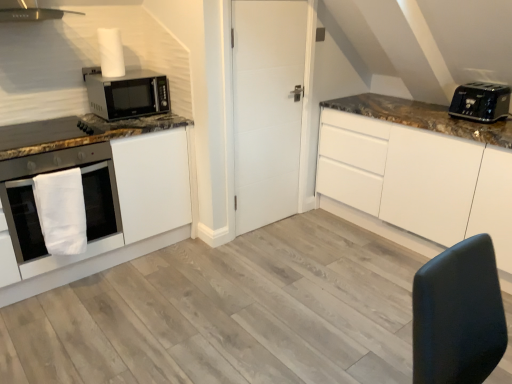
Question: Is satin white cabinet at left, which is the second cabinetry from right to left, inside or outside of white matte door at center?

Choices:
 (A) outside
 (B) inside

Answer: (A)

Question: From the image's perspective, is satin white cabinet at left, which is the second cabinetry from right to left, positioned above or below white matte door at center?

Choices:
 (A) below
 (B) above

Answer: (A)

Question: Which object is the closest to the white matte cabinet at upper right, positioned as the 2th cabinetry in left-to-right order?

Choices:
 (A) satin white cabinet at left, which is the second cabinetry from right to left
 (B) white cloth hand towel at lower left
 (C) black plastic toaster at upper right
 (D) matte black microwave at upper left
 (E) white matte door at center

Answer: (C)

Question: Which object is the closest to the white matte door at center?

Choices:
 (A) white cloth hand towel at lower left
 (B) satin white cabinet at left, positioned as the 1th cabinetry in left-to-right order
 (C) white glossy oven at left
 (D) white matte cabinet at upper right, positioned as the 2th cabinetry in left-to-right order
 (E) black plastic toaster at upper right

Answer: (B)